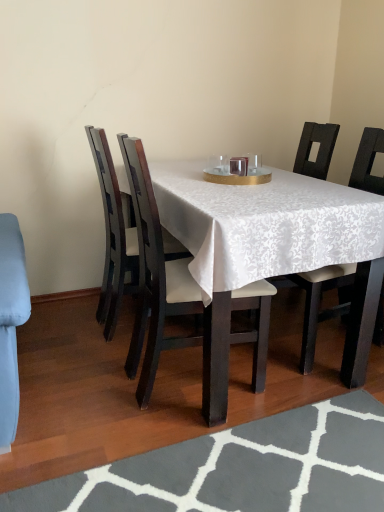
Identify the location of vacant space underneath gray textured rug at lower center (from a real-world perspective). This screenshot has width=384, height=512. (260, 475).